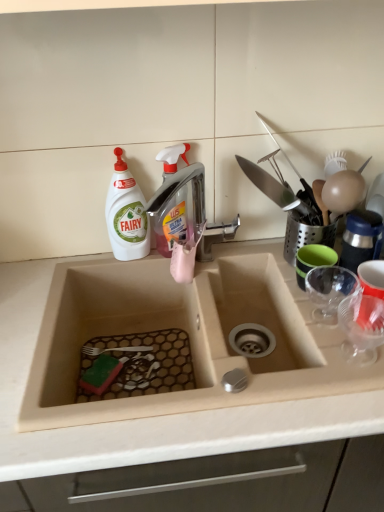
This screenshot has height=512, width=384. Find the location of `free space that is to the left of transparent plastic cup at right, placed as the 1th tableware when sorted from front to back`. free space that is to the left of transparent plastic cup at right, placed as the 1th tableware when sorted from front to back is located at coordinates (281, 371).